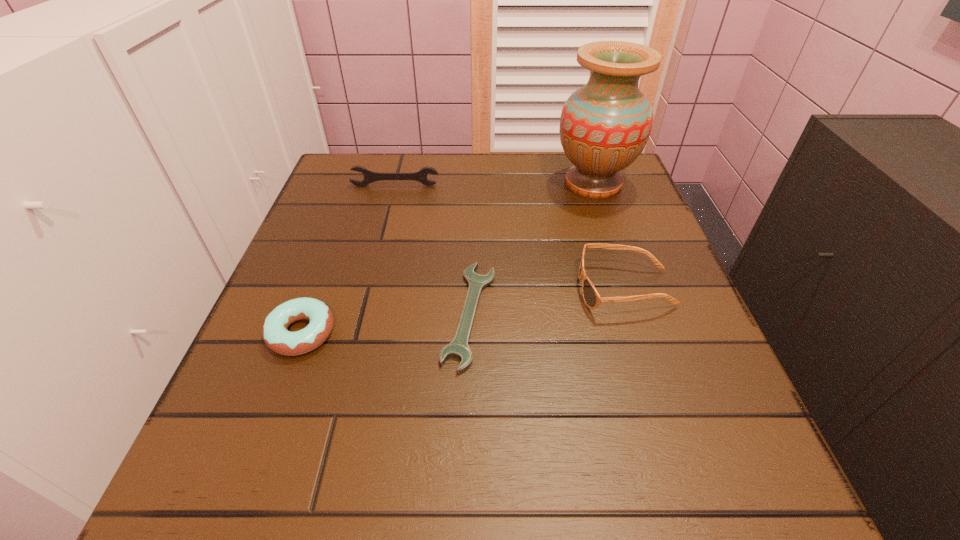
I want to click on empty location between the shortest object and the left wrench, so click(432, 250).

Where is `free space between the third object from right to left and the tallest object`? free space between the third object from right to left and the tallest object is located at coordinates tap(532, 249).

The image size is (960, 540). What are the coordinates of `vacant space in between the vase and the taller wrench` in the screenshot? It's located at (494, 185).

This screenshot has width=960, height=540. Find the location of `vacant point located between the right wrench and the farther wrench`. vacant point located between the right wrench and the farther wrench is located at coordinates (432, 250).

Where is `vacant region between the sunglasses and the tallest object`? vacant region between the sunglasses and the tallest object is located at coordinates coord(609,236).

Identify the location of vacant area between the tallest object and the sunglasses. This screenshot has height=540, width=960. (609, 236).

Where is `free space that is in between the sunglasses and the right wrench`? The height and width of the screenshot is (540, 960). free space that is in between the sunglasses and the right wrench is located at coordinates (547, 301).

Locate an element on the screen. This screenshot has height=540, width=960. free point between the sunglasses and the right wrench is located at coordinates (547, 301).

Where is `object that can be found as the third closest to the farther wrench`? This screenshot has height=540, width=960. object that can be found as the third closest to the farther wrench is located at coordinates (592, 299).

Select which object appears as the fourth closest to the left wrench. Please provide its 2D coordinates. Your answer should be formatted as a tuple, i.e. [(x, y)], where the tuple contains the x and y coordinates of a point satisfying the conditions above.

[(276, 336)]